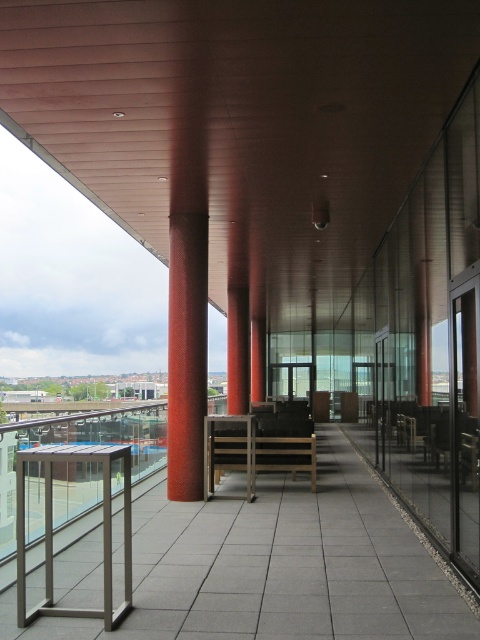
Question: Considering the relative positions of red textured column at center and silver metallic balustrade at lower left in the image provided, where is red textured column at center located with respect to silver metallic balustrade at lower left?

Choices:
 (A) right
 (B) left

Answer: (A)

Question: Can you confirm if red textured column at center is positioned to the left of silver metallic balustrade at lower left?

Choices:
 (A) yes
 (B) no

Answer: (B)

Question: Is red textured column at center below silver metallic balustrade at lower left?

Choices:
 (A) no
 (B) yes

Answer: (A)